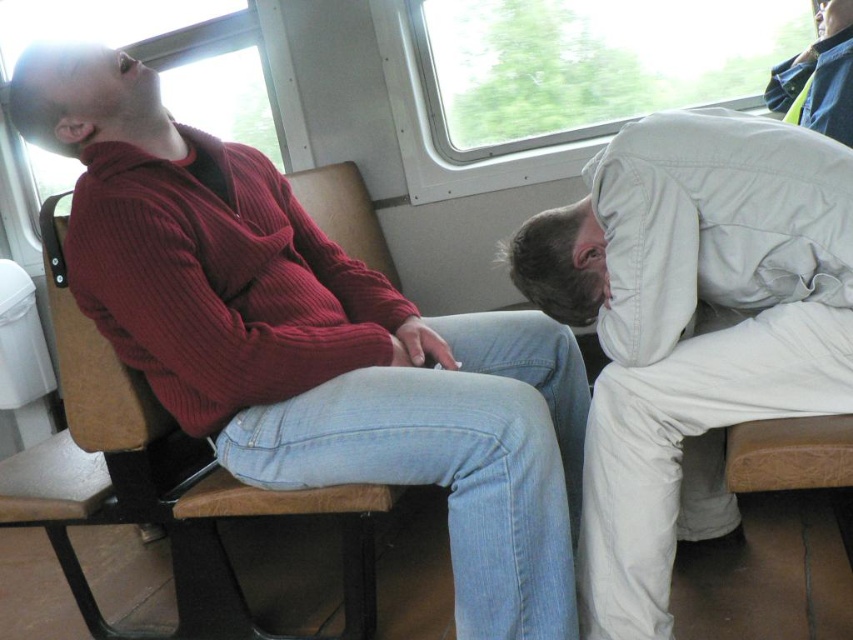
Is the position of ribbed sweater at center more distant than that of light beige cotton pants at right?

Yes, it is behind light beige cotton pants at right.

Is ribbed sweater at center thinner than light beige cotton pants at right?

No, ribbed sweater at center is not thinner than light beige cotton pants at right.

Does point (16, 120) come farther from viewer compared to point (611, 228)?

Yes, point (16, 120) is behind point (611, 228).

Where is `ribbed sweater at center`? ribbed sweater at center is located at coordinates (311, 340).